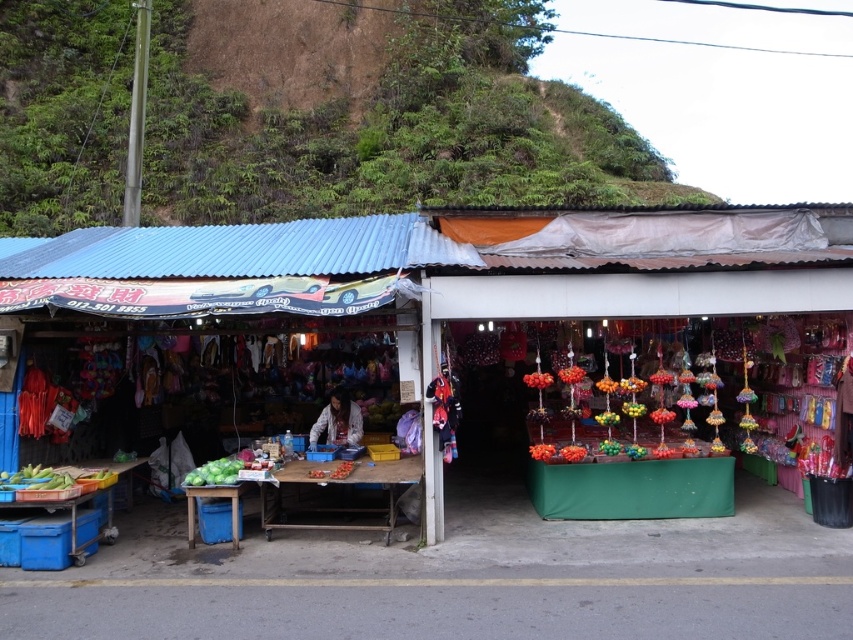
Who is higher up, matte plastic stall at center or green grassy hillside at upper left?

green grassy hillside at upper left is higher up.

Does matte plastic stall at center appear on the right side of green grassy hillside at upper left?

Correct, you'll find matte plastic stall at center to the right of green grassy hillside at upper left.

Identify the location of matte plastic stall at center. (436, 288).

Based on the photo, how far apart are dark brown fabric vendor at center and green matte cabbage at lower left?

dark brown fabric vendor at center is 1.22 meters from green matte cabbage at lower left.

Can you confirm if dark brown fabric vendor at center is bigger than green matte cabbage at lower left?

Correct, dark brown fabric vendor at center is larger in size than green matte cabbage at lower left.

Image resolution: width=853 pixels, height=640 pixels. What do you see at coordinates (338, 420) in the screenshot?
I see `dark brown fabric vendor at center` at bounding box center [338, 420].

At what (x,y) coordinates should I click in order to perform the action: click on dark brown fabric vendor at center. Please return your answer as a coordinate pair (x, y). This screenshot has height=640, width=853. Looking at the image, I should click on (338, 420).

Is matte plastic stall at center shorter than dark brown fabric vendor at center?

No.

Is point (381, 276) in front of point (344, 394)?

Yes.

Is point (746, 230) closer to camera compared to point (345, 412)?

Yes, it is in front of point (345, 412).

Locate an element on the screen. The width and height of the screenshot is (853, 640). matte plastic stall at center is located at coordinates (436, 288).